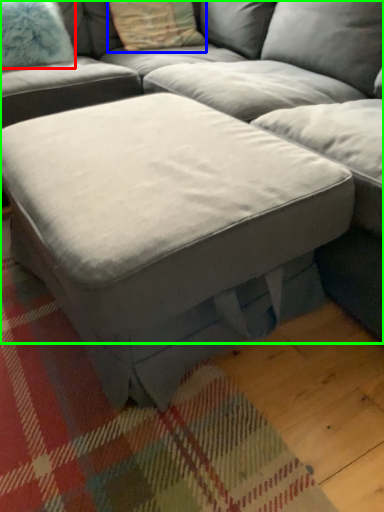
Question: Which is nearer to the pillow (highlighted by a red box)? pillow (highlighted by a blue box) or studio couch (highlighted by a green box).

Choices:
 (A) pillow
 (B) studio couch

Answer: (A)